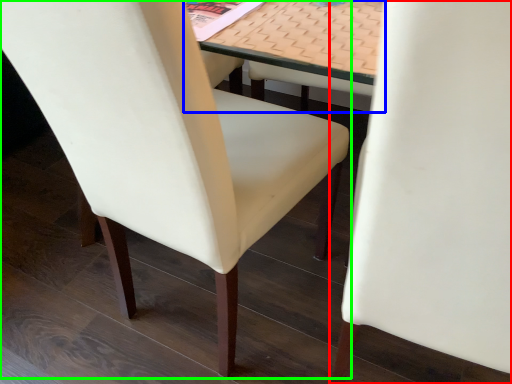
Question: Based on their relative distances, which object is farther from chair (highlighted by a red box)? Choose from table (highlighted by a blue box) and chair (highlighted by a green box).

Choices:
 (A) table
 (B) chair

Answer: (B)